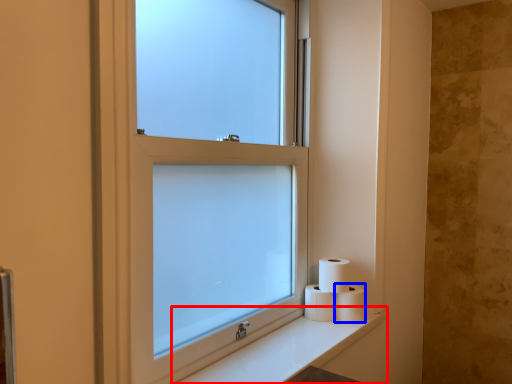
Question: Which object appears farthest to the camera in this image, counter top (highlighted by a red box) or toilet paper (highlighted by a blue box)?

Choices:
 (A) counter top
 (B) toilet paper

Answer: (B)